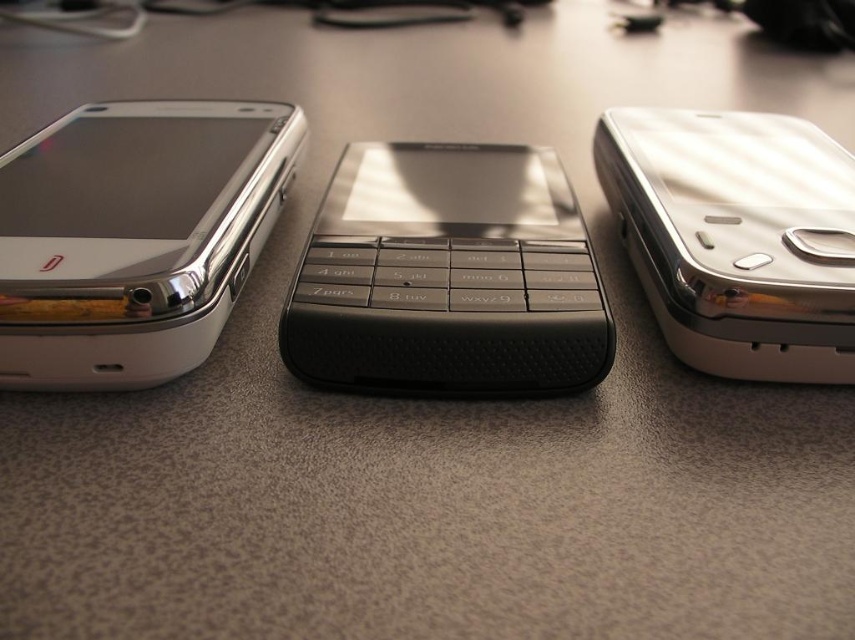
You are standing in front of a desk with three phones. The matte silver smartphone at left is closest to you. Which phone is the closest to your position?

The matte silver smartphone at left is the closest to you as it is only 32.20 inches away from the viewer.

You are organizing a tech exhibit and need to arrange these phones vertically on a shelf. The shelf has limited height space. Which phone, the black textured keypad at center or the metallic silver phone at right, should you place first to ensure both fit without exceeding the shelf height?

The black textured keypad at center is not as tall as the metallic silver phone at right, so you should place the metallic silver phone at right first on the shelf to accommodate its greater height, then place the black textured keypad at center below it.

Looking at this image, you are standing in front of the three mobile phones arranged side by side on the desk. There are two points marked on the image at coordinates point (355, 198) and point (759, 280). Which point is closer to you?

Point (355, 198) is behind point (759, 280), so the point closer to you is point (759, 280).